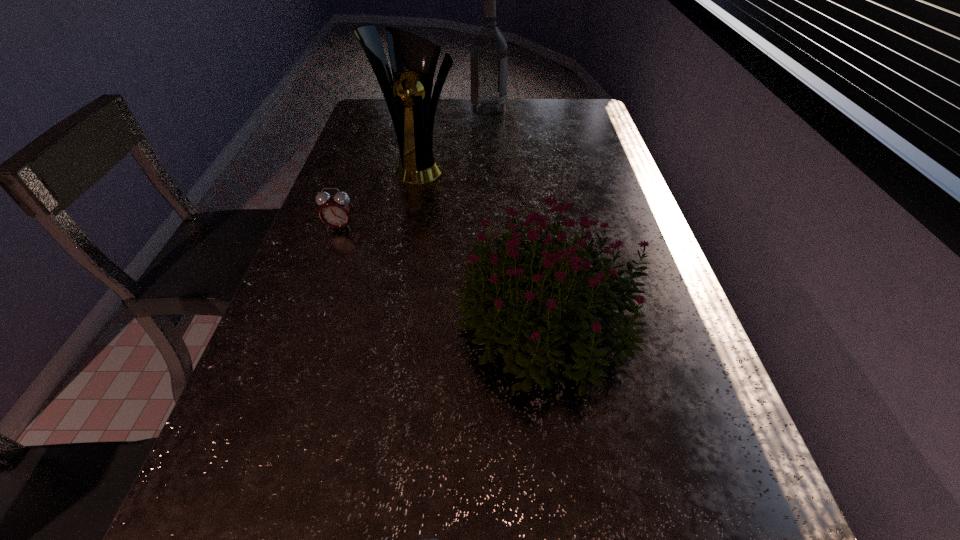
Find the location of a particular element. The height and width of the screenshot is (540, 960). vacant region located 0.090m on the back of the bouquet is located at coordinates coord(538,237).

Locate an element on the screen. This screenshot has height=540, width=960. vacant space located on the clock face of the leftmost object is located at coordinates (327, 262).

At what (x,y) coordinates should I click in order to perform the action: click on object at the far edge. Please return your answer as a coordinate pair (x, y). Looking at the image, I should click on (488, 48).

Identify the location of award situated at the left edge. (413, 59).

The height and width of the screenshot is (540, 960). Find the location of `alarm clock located at the left edge`. alarm clock located at the left edge is located at coordinates [x=336, y=210].

Where is `object that is at the right edge`? The width and height of the screenshot is (960, 540). object that is at the right edge is located at coordinates (530, 331).

You are a GUI agent. You are given a task and a screenshot of the screen. Output one action in this format:
    pyautogui.click(x=<x>, y=<y>)
    Task: Click on the free space at the far edge of the desktop
    Image resolution: width=960 pixels, height=540 pixels.
    Given the screenshot: What is the action you would take?
    pyautogui.click(x=545, y=102)

Where is `free space at the left edge`? free space at the left edge is located at coordinates (292, 426).

In the image, there is a desktop. Identify the location of vacant space at the right edge. The height and width of the screenshot is (540, 960). (589, 152).

The image size is (960, 540). I want to click on vacant space at the far right corner of the desktop, so click(x=569, y=122).